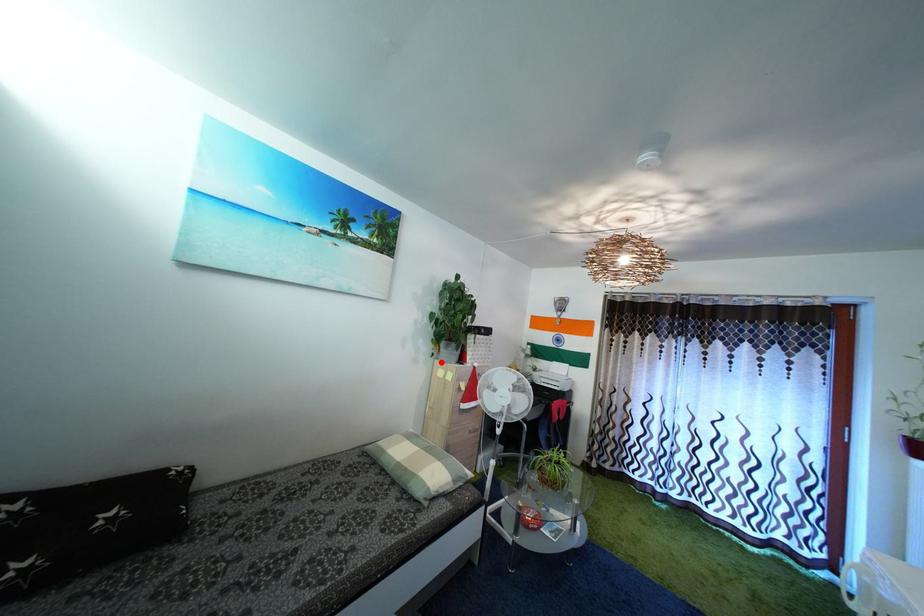
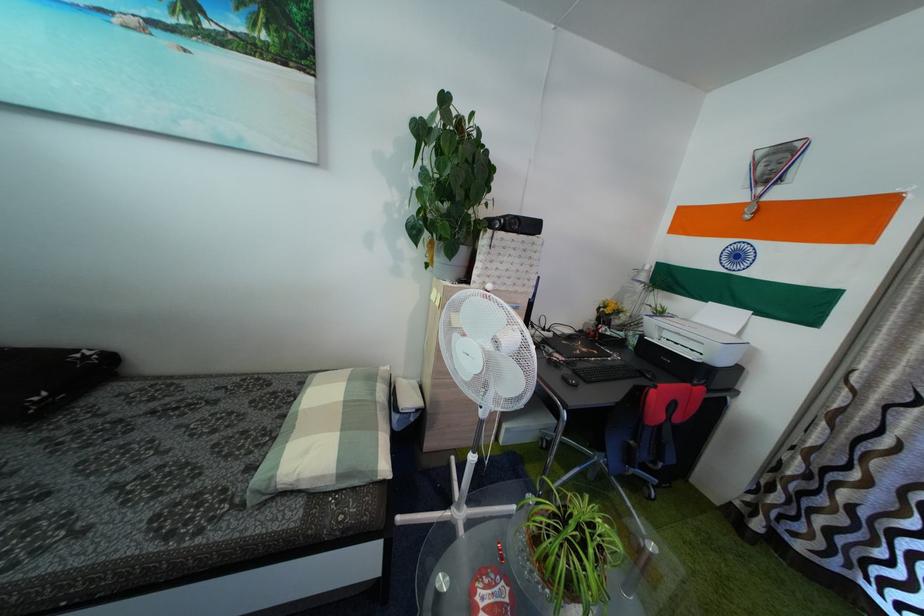
Where in the second image is the point corresponding to the highlighted location from the first image?

(435, 273)